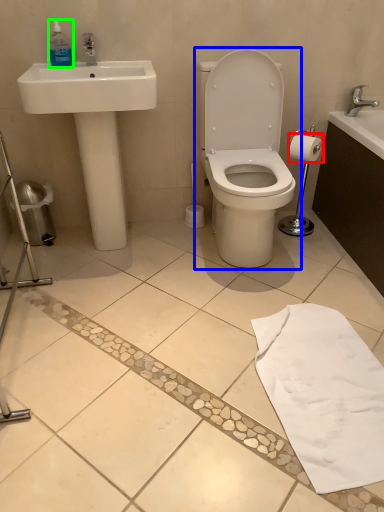
Question: Based on their relative distances, which object is farther from toilet paper (highlighted by a red box)? Choose from toilet (highlighted by a blue box) and bottle (highlighted by a green box).

Choices:
 (A) toilet
 (B) bottle

Answer: (B)